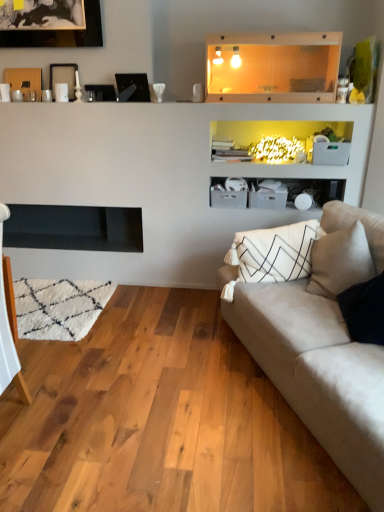
Question: Does suede beige couch at right lie in front of matte black picture frame at upper center, which is the 3th picture frame from left to right?

Choices:
 (A) no
 (B) yes

Answer: (B)

Question: Considering the relative sizes of suede beige couch at right and matte black picture frame at upper center, the second picture frame positioned from the right, in the image provided, is suede beige couch at right wider than matte black picture frame at upper center, the second picture frame positioned from the right,?

Choices:
 (A) yes
 (B) no

Answer: (A)

Question: Is suede beige couch at right positioned far away from matte black picture frame at upper center, the second picture frame positioned from the right?

Choices:
 (A) no
 (B) yes

Answer: (B)

Question: From a real-world perspective, is suede beige couch at right beneath matte black picture frame at upper center, which is the 3th picture frame from left to right?

Choices:
 (A) no
 (B) yes

Answer: (B)

Question: From the image's perspective, would you say suede beige couch at right is positioned over matte black picture frame at upper center, which is the 3th picture frame from left to right?

Choices:
 (A) no
 (B) yes

Answer: (A)

Question: Considering the relative sizes of suede beige couch at right and matte black picture frame at upper center, which is the 3th picture frame from left to right, in the image provided, is suede beige couch at right shorter than matte black picture frame at upper center, which is the 3th picture frame from left to right,?

Choices:
 (A) no
 (B) yes

Answer: (A)

Question: Can you confirm if transparent glass shelf at upper center is wider than black matte fireplace at left?

Choices:
 (A) yes
 (B) no

Answer: (B)

Question: Is transparent glass shelf at upper center at the right side of black matte fireplace at left?

Choices:
 (A) yes
 (B) no

Answer: (A)

Question: Is transparent glass shelf at upper center taller than black matte fireplace at left?

Choices:
 (A) no
 (B) yes

Answer: (B)

Question: Is transparent glass shelf at upper center facing towards black matte fireplace at left?

Choices:
 (A) yes
 (B) no

Answer: (B)

Question: Is transparent glass shelf at upper center smaller than black matte fireplace at left?

Choices:
 (A) yes
 (B) no

Answer: (A)

Question: From the image's perspective, is transparent glass shelf at upper center on black matte fireplace at left?

Choices:
 (A) no
 (B) yes

Answer: (B)

Question: From the image's perspective, is wooden picture frame at upper left, the third picture frame from the right, located beneath black glass picture frame at upper center, marked as the 4th picture frame in a left-to-right arrangement?

Choices:
 (A) no
 (B) yes

Answer: (A)